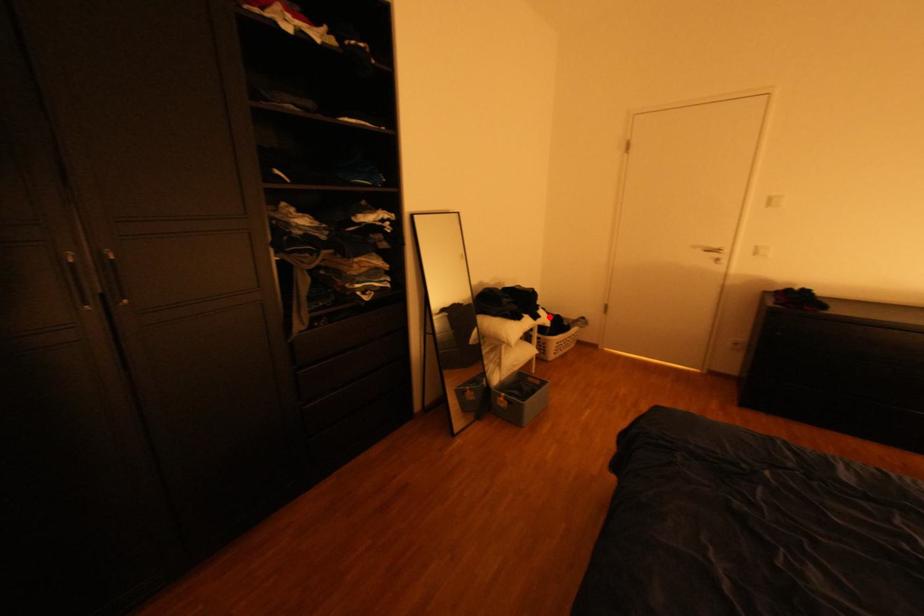
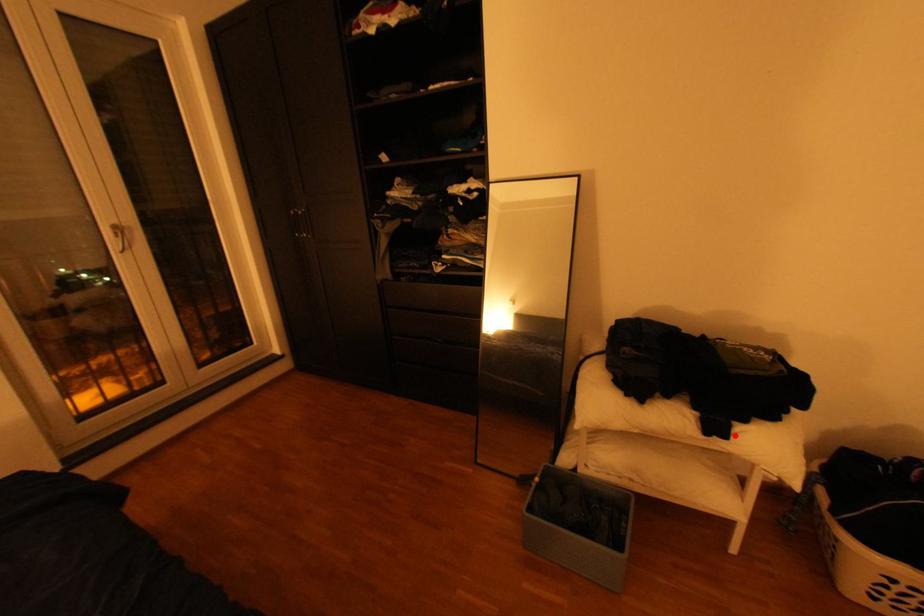
I am providing you with two images of the same scene from different viewpoints. A red point is marked on the first image and another point is marked on the second image. Is the red point in image1 aligned with the point shown in image2?

Yes